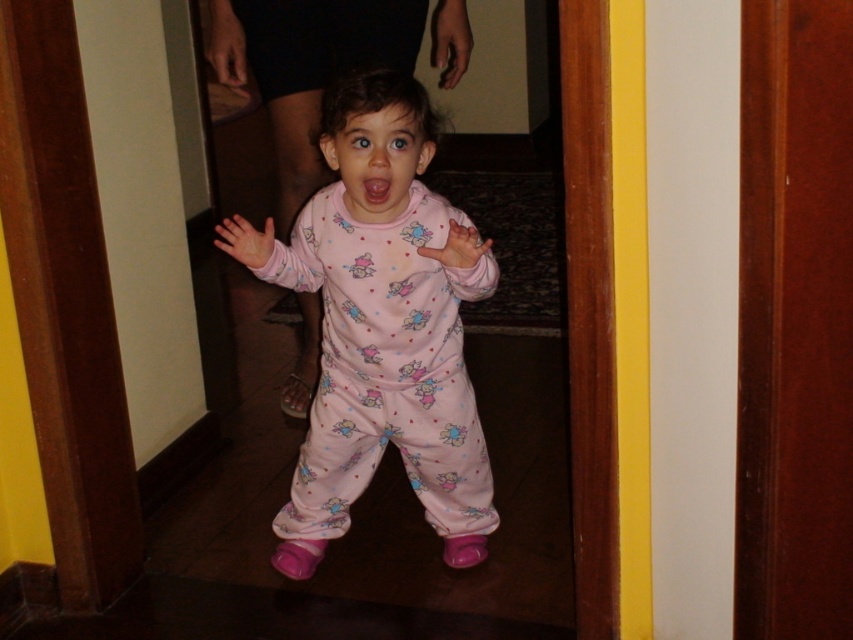
Which is more to the left, pink cotton pajamas at center or wooden door at center?

pink cotton pajamas at center is more to the left.

Can you confirm if pink cotton pajamas at center is positioned below wooden door at center?

Yes, pink cotton pajamas at center is below wooden door at center.

Based on the photo, who is more distant from viewer, (381, 282) or (753, 42)?

The point (381, 282) is more distant.

You are a GUI agent. You are given a task and a screenshot of the screen. Output one action in this format:
    pyautogui.click(x=<x>, y=<y>)
    Task: Click on the pink cotton pajamas at center
    
    Given the screenshot: What is the action you would take?
    pyautogui.click(x=381, y=326)

Between point (820, 374) and point (370, 177), which one is positioned behind?

Positioned behind is point (370, 177).

Based on the photo, is wooden door at center above pink matte mouth at center?

No.

Which is behind, point (769, 436) or point (392, 180)?

The point (392, 180) is behind.

Identify the location of wooden door at center. (793, 323).

Does pink cotton pajamas at center have a larger size compared to pink matte mouth at center?

Yes.

Between point (476, 428) and point (381, 200), which one is positioned in front?

Point (381, 200) is in front.

This screenshot has height=640, width=853. Identify the location of pink cotton pajamas at center. (381, 326).